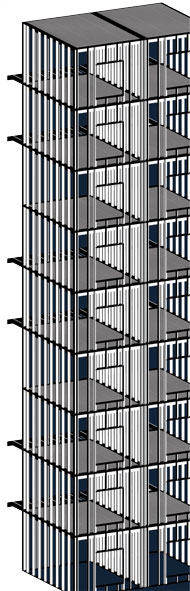
Image resolution: width=190 pixels, height=591 pixels. Identify the location of sixth floor rooms. (110, 272), (173, 264).